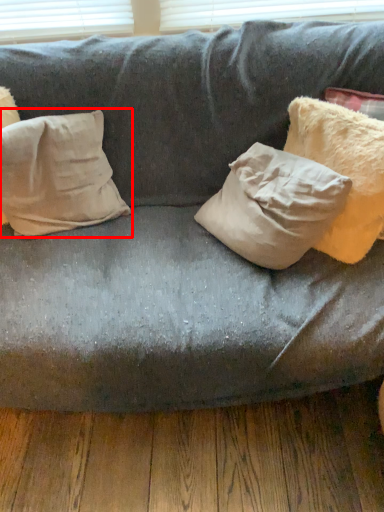
Question: In this image, where is pillow (annotated by the red box) located relative to pillow?

Choices:
 (A) right
 (B) left

Answer: (B)